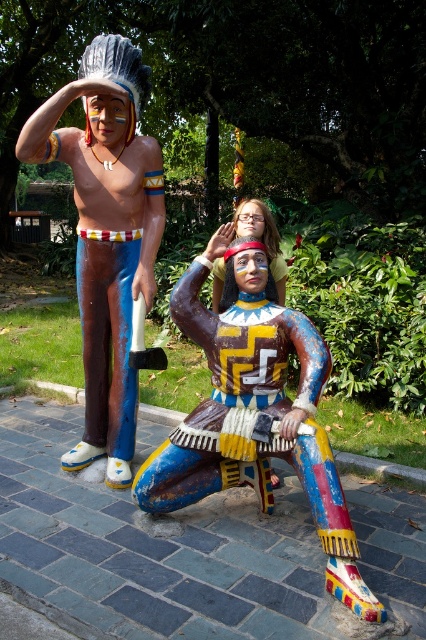
You are standing in front of the two statues and notice two points marked on them. The first point is at coordinate point (224, 250) and the second is at point (117, 300). Which point is closer to you?

Point (224, 250) is closer to the viewer than point (117, 300).

You are an art student analyzing the statues in the image. You need to determine which statue is shorter. Which one is shorter between the painted wood figure at center and the matte painted figure at left?

The painted wood figure at center is shorter than the matte painted figure at left.